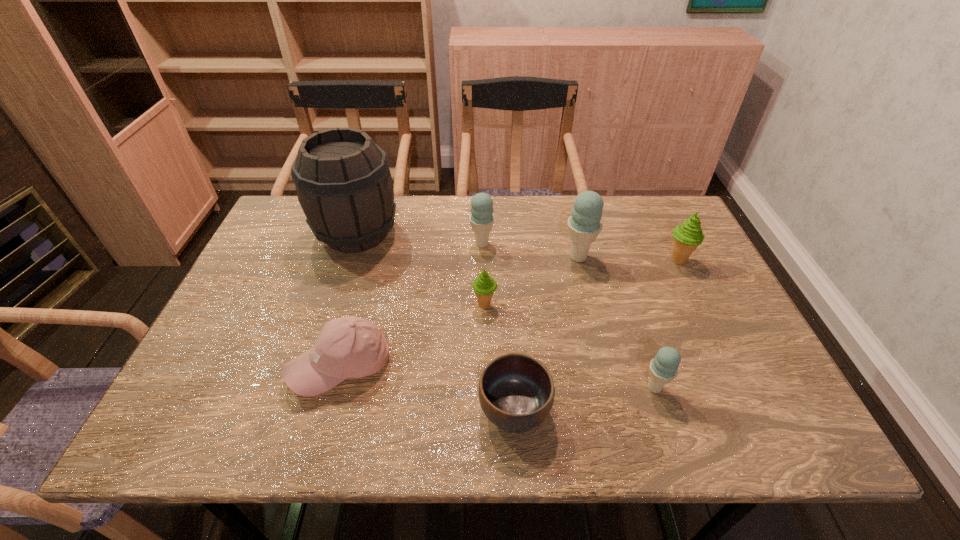
You are a GUI agent. You are given a task and a screenshot of the screen. Output one action in this format:
    pyautogui.click(x=<x>, y=<y>)
    Task: Click on the vacant region that satisfies the following two spatial constraints: 1. on the front side of the right green icecream; 2. on the left side of the leftmost blue ice cream
    The image size is (960, 540).
    Given the screenshot: What is the action you would take?
    pyautogui.click(x=482, y=260)